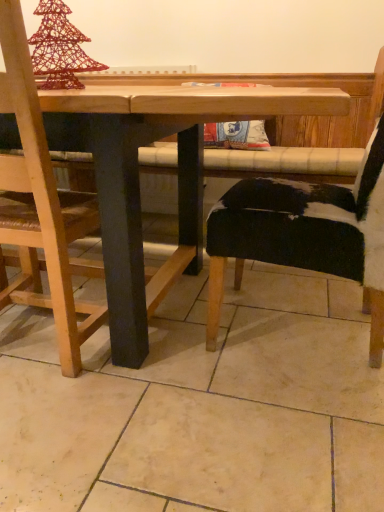
In order to click on free spot in front of black cowhide chair at right, the second chair in the left-to-right sequence in this screenshot , I will do `click(288, 436)`.